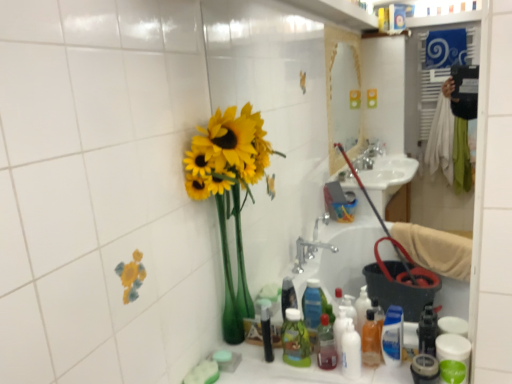
What are the coordinates of `translucent plastic bottle at center, which is counted as the 2th bottle, starting from the right` in the screenshot? It's located at (326, 345).

At what (x,y) coordinates should I click in order to perform the action: click on black plastic toothbrush at lower center, which is the 3th bottle in right-to-left order. Please return your answer as a coordinate pair (x, y). This screenshot has height=384, width=512. Looking at the image, I should click on (266, 332).

Looking at this image, measure the distance between point (355, 341) and camera.

The distance of point (355, 341) from camera is 4.98 feet.

What do you see at coordinates (392, 336) in the screenshot?
I see `blue glossy bottle at lower right, acting as the 1th cleaning product starting from the right` at bounding box center [392, 336].

Locate an element on the screen. Image resolution: width=512 pixels, height=384 pixels. translucent plastic bottle at center, which is counted as the 2th bottle, starting from the right is located at coordinates (326, 345).

Considering the relative positions of translucent plastic bottle at center, which is counted as the 2th bottle, starting from the right, and green plastic bottle at lower center in the image provided, is translucent plastic bottle at center, which is counted as the 2th bottle, starting from the right, to the left of green plastic bottle at lower center from the viewer's perspective?

In fact, translucent plastic bottle at center, which is counted as the 2th bottle, starting from the right, is to the right of green plastic bottle at lower center.

Identify the location of toiletry that appears above the translucent plastic bottle at center, which is counted as the 2th bottle, starting from the right (from the image's perspective). (295, 340).

Is translucent plastic bottle at center, which is counted as the 2th bottle, starting from the right, oriented towards green plastic bottle at lower center?

No, translucent plastic bottle at center, which is counted as the 2th bottle, starting from the right, is not facing towards green plastic bottle at lower center.

Does point (298, 345) lie in front of point (367, 312)?

Yes, it is in front of point (367, 312).

From their relative heights in the image, would you say green plastic bottle at lower center is taller or shorter than translucent orange bottle at lower center, which is the 3th bottle in left-to-right order?

Considering their sizes, green plastic bottle at lower center has more height than translucent orange bottle at lower center, which is the 3th bottle in left-to-right order.

From a real-world perspective, is green plastic bottle at lower center above or below translucent orange bottle at lower center, which is the 3th bottle in left-to-right order?

green plastic bottle at lower center is situated higher than translucent orange bottle at lower center, which is the 3th bottle in left-to-right order, in the real world.

Based on the photo, does green plastic bottle at lower center have a greater width compared to translucent orange bottle at lower center, which is the 3th bottle in left-to-right order?

In fact, green plastic bottle at lower center might be narrower than translucent orange bottle at lower center, which is the 3th bottle in left-to-right order.

Looking at this image, from their relative heights in the image, would you say black plastic toothbrush at lower center, which is the 3th bottle in right-to-left order, is taller or shorter than translucent orange bottle at lower center, which is the 3th bottle in left-to-right order?

Considering their sizes, black plastic toothbrush at lower center, which is the 3th bottle in right-to-left order, has more height than translucent orange bottle at lower center, which is the 3th bottle in left-to-right order.

Is black plastic toothbrush at lower center, marked as the first bottle in a left-to-right arrangement, looking in the opposite direction of translucent orange bottle at lower center, which is the 3th bottle in left-to-right order?

No, black plastic toothbrush at lower center, marked as the first bottle in a left-to-right arrangement,'s orientation is not away from translucent orange bottle at lower center, which is the 3th bottle in left-to-right order.

Between black plastic toothbrush at lower center, marked as the first bottle in a left-to-right arrangement, and translucent orange bottle at lower center, which is the first bottle from right to left, which one appears on the right side from the viewer's perspective?

From the viewer's perspective, translucent orange bottle at lower center, which is the first bottle from right to left, appears more on the right side.

Between blue glossy bottle at lower right, positioned as the second cleaning product in left-to-right order, and green plastic bottle at lower center, which one has larger size?

Bigger between the two is green plastic bottle at lower center.

Considering the points (383, 337) and (295, 336), which point is in front, point (383, 337) or point (295, 336)?

The point (383, 337) is in front.

Can you tell me how much blue glossy bottle at lower right, positioned as the second cleaning product in left-to-right order, and green plastic bottle at lower center differ in facing direction?

The angle between the facing direction of blue glossy bottle at lower right, positioned as the second cleaning product in left-to-right order, and the facing direction of green plastic bottle at lower center is 3.32 degrees.

Who is taller, blue glossy bottle at lower right, positioned as the second cleaning product in left-to-right order, or green plastic bottle at lower center?

green plastic bottle at lower center is taller.

Does point (344, 334) lie behind point (321, 348)?

No, (344, 334) is closer to viewer.

Does white glossy bottle at lower center, arranged as the 2th cleaning product when viewed from the right, have a lesser width compared to translucent plastic bottle at center, which appears as the second bottle when viewed from the left?

Indeed, white glossy bottle at lower center, arranged as the 2th cleaning product when viewed from the right, has a lesser width compared to translucent plastic bottle at center, which appears as the second bottle when viewed from the left.

Considering the relative sizes of white glossy bottle at lower center, arranged as the 2th cleaning product when viewed from the right, and translucent plastic bottle at center, which is counted as the 2th bottle, starting from the right, in the image provided, is white glossy bottle at lower center, arranged as the 2th cleaning product when viewed from the right, shorter than translucent plastic bottle at center, which is counted as the 2th bottle, starting from the right,?

No, white glossy bottle at lower center, arranged as the 2th cleaning product when viewed from the right, is not shorter than translucent plastic bottle at center, which is counted as the 2th bottle, starting from the right.

Is white glossy bottle at lower center, arranged as the 2th cleaning product when viewed from the right, positioned with its back to translucent plastic bottle at center, which appears as the second bottle when viewed from the left?

No.

Can you confirm if yellow matte sunflowers at left is wider than black plastic toothbrush at lower center, which is the 3th bottle in right-to-left order?

Correct, the width of yellow matte sunflowers at left exceeds that of black plastic toothbrush at lower center, which is the 3th bottle in right-to-left order.

Could you tell me if yellow matte sunflowers at left is facing black plastic toothbrush at lower center, which is the 3th bottle in right-to-left order?

No, yellow matte sunflowers at left is not aimed at black plastic toothbrush at lower center, which is the 3th bottle in right-to-left order.

Starting from the yellow matte sunflowers at left, which bottle is the 1st one to the right? Please provide its 2D coordinates.

[(266, 332)]

Is yellow matte sunflowers at left bigger or smaller than black plastic toothbrush at lower center, marked as the first bottle in a left-to-right arrangement?

Clearly, yellow matte sunflowers at left is larger in size than black plastic toothbrush at lower center, marked as the first bottle in a left-to-right arrangement.

You are a GUI agent. You are given a task and a screenshot of the screen. Output one action in this format:
    pyautogui.click(x=<x>, y=<y>)
    Task: Click on the cleaning product behind the translucent orange bottle at lower center, which is the first bottle from right to left
    
    Given the screenshot: What is the action you would take?
    tap(392, 336)

From the picture: Can you confirm if blue glossy bottle at lower right, acting as the 1th cleaning product starting from the right, is positioned to the right of translucent orange bottle at lower center, which is the 3th bottle in left-to-right order?

Indeed, blue glossy bottle at lower right, acting as the 1th cleaning product starting from the right, is positioned on the right side of translucent orange bottle at lower center, which is the 3th bottle in left-to-right order.

Which point is more distant from viewer, (397, 343) or (376, 342)?

Point (376, 342)

Find the location of a particular element. This screenshot has height=384, width=512. toiletry behind the translucent plastic bottle at center, which appears as the second bottle when viewed from the left is located at coordinates (295, 340).

Where is `toiletry positioned vertically above the translucent orange bottle at lower center, which is the 3th bottle in left-to-right order (from a real-world perspective)`? toiletry positioned vertically above the translucent orange bottle at lower center, which is the 3th bottle in left-to-right order (from a real-world perspective) is located at coordinates (295, 340).

Considering their positions, is yellow matte sunflowers at left positioned further to white glossy bottle at lower center, which ranks as the 1th cleaning product in left-to-right order, than translucent orange bottle at lower center, which is the 3th bottle in left-to-right order?

Result: Based on the image, yellow matte sunflowers at left appears to be further to white glossy bottle at lower center, which ranks as the 1th cleaning product in left-to-right order.

Looking at the image, which one is located further to yellow matte sunflowers at left, translucent plastic bottle at center, which is counted as the 2th bottle, starting from the right, or translucent orange bottle at lower center, which is the first bottle from right to left?

The object further to yellow matte sunflowers at left is translucent orange bottle at lower center, which is the first bottle from right to left.

Estimate the real-world distances between objects in this image. Which object is further from translucent orange bottle at lower center, which is the first bottle from right to left, white glossy bottle at lower center, which ranks as the 1th cleaning product in left-to-right order, or black plastic toothbrush at lower center, which is the 3th bottle in right-to-left order?

The object further to translucent orange bottle at lower center, which is the first bottle from right to left, is black plastic toothbrush at lower center, which is the 3th bottle in right-to-left order.

Based on their spatial positions, is yellow matte sunflowers at left or white glossy bottle at lower center, arranged as the 2th cleaning product when viewed from the right, further from black plastic toothbrush at lower center, marked as the first bottle in a left-to-right arrangement?

yellow matte sunflowers at left is positioned further to the anchor black plastic toothbrush at lower center, marked as the first bottle in a left-to-right arrangement.

Which object lies nearer to the anchor point black plastic toothbrush at lower center, marked as the first bottle in a left-to-right arrangement, white glossy bottle at lower center, arranged as the 2th cleaning product when viewed from the right, or yellow matte sunflowers at left?

white glossy bottle at lower center, arranged as the 2th cleaning product when viewed from the right, is closer to black plastic toothbrush at lower center, marked as the first bottle in a left-to-right arrangement.

Which object lies nearer to the anchor point translucent plastic bottle at center, which appears as the second bottle when viewed from the left, translucent orange bottle at lower center, which is the first bottle from right to left, or green plastic bottle at lower center?

Based on the image, green plastic bottle at lower center appears to be nearer to translucent plastic bottle at center, which appears as the second bottle when viewed from the left.

Estimate the real-world distances between objects in this image. Which object is closer to blue glossy bottle at lower right, acting as the 1th cleaning product starting from the right, green plastic bottle at lower center or white glossy bottle at lower center, arranged as the 2th cleaning product when viewed from the right?

The object closer to blue glossy bottle at lower right, acting as the 1th cleaning product starting from the right, is white glossy bottle at lower center, arranged as the 2th cleaning product when viewed from the right.

Looking at the image, which one is located further to blue glossy bottle at lower right, positioned as the second cleaning product in left-to-right order, black plastic toothbrush at lower center, which is the 3th bottle in right-to-left order, or green plastic bottle at lower center?

black plastic toothbrush at lower center, which is the 3th bottle in right-to-left order.

Locate an element on the screen. cleaning product between green plastic bottle at lower center and blue glossy bottle at lower right, acting as the 1th cleaning product starting from the right is located at coordinates (351, 352).

The width and height of the screenshot is (512, 384). I want to click on bottle between black plastic toothbrush at lower center, marked as the first bottle in a left-to-right arrangement, and white glossy bottle at lower center, arranged as the 2th cleaning product when viewed from the right, so click(x=326, y=345).

This screenshot has width=512, height=384. I want to click on bottle between green plastic bottle at lower center and translucent orange bottle at lower center, which is the first bottle from right to left, from left to right, so click(326, 345).

You are a GUI agent. You are given a task and a screenshot of the screen. Output one action in this format:
    pyautogui.click(x=<x>, y=<y>)
    Task: Click on the cleaning product between green plastic bottle at lower center and translucent orange bottle at lower center, which is the first bottle from right to left
    The width and height of the screenshot is (512, 384).
    Given the screenshot: What is the action you would take?
    pyautogui.click(x=351, y=352)